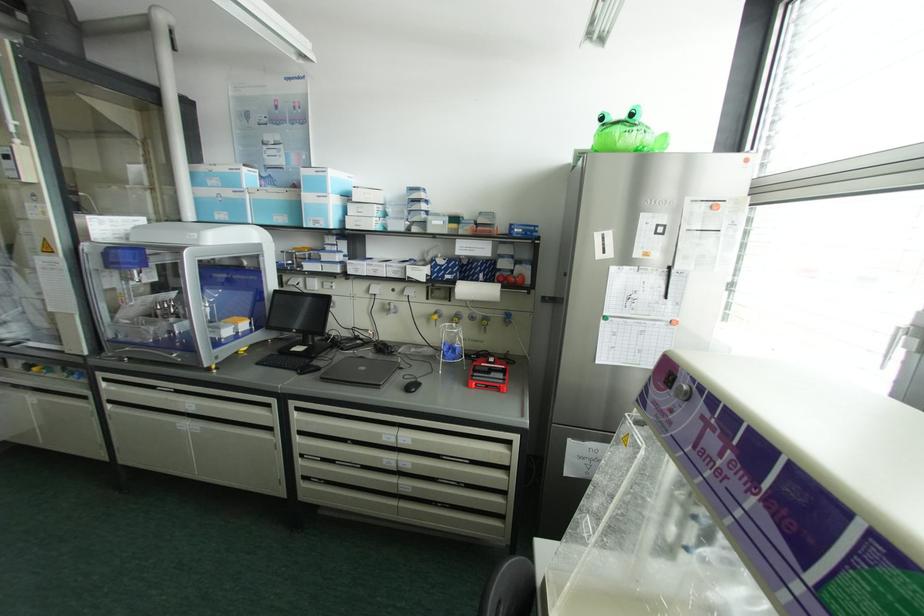
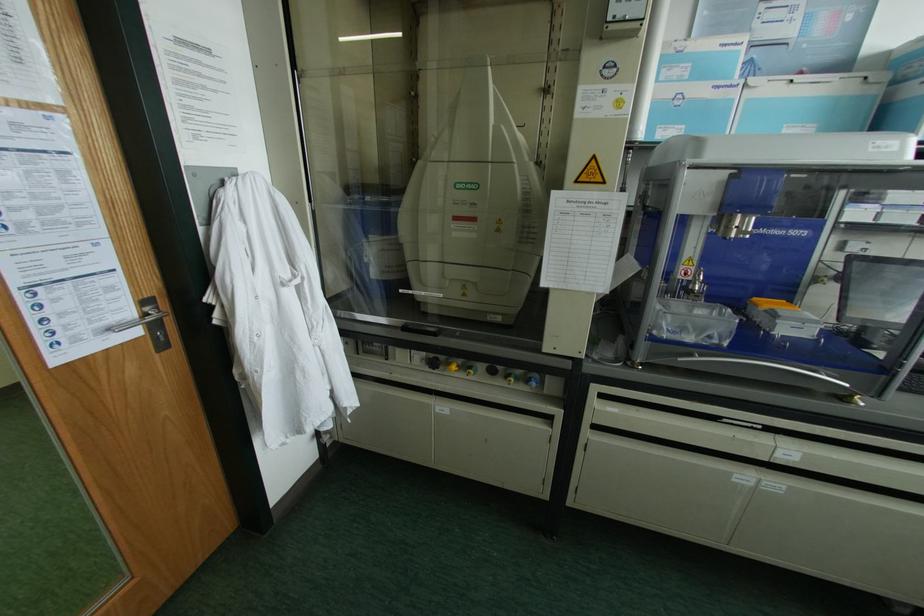
In the second image, find the point that corresponds to [190,403] in the first image.

(789, 451)